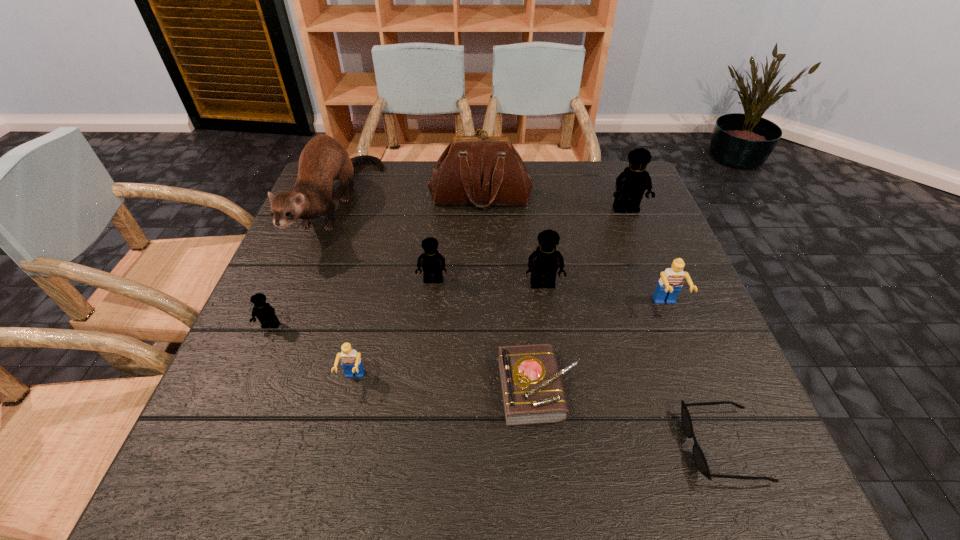
Locate an element on the screen. Image resolution: width=960 pixels, height=540 pixels. vacant area at the near edge of the desktop is located at coordinates (285, 495).

Where is `vacant space at the left edge of the desktop`? This screenshot has height=540, width=960. vacant space at the left edge of the desktop is located at coordinates (299, 268).

Find the location of a particular element. The width and height of the screenshot is (960, 540). vacant space at the right edge of the desktop is located at coordinates (705, 413).

Locate an element on the screen. The image size is (960, 540). free spot between the black sunglasses and the bigger blue Lego is located at coordinates 695,376.

The width and height of the screenshot is (960, 540). I want to click on unoccupied position between the second nearest Lego and the ninth tallest object, so click(404, 357).

The width and height of the screenshot is (960, 540). I want to click on free area in between the ninth tallest object and the shoulder bag, so pos(510,293).

The height and width of the screenshot is (540, 960). I want to click on vacant space in between the brown ferret and the leftmost yellow Lego, so click(x=304, y=267).

Find the location of a particular element. empty location between the shoulder bag and the farthest yellow Lego is located at coordinates (553, 204).

The width and height of the screenshot is (960, 540). Identify the location of vacant space that is in between the leftmost Lego and the brown shoulder bag. (375, 262).

At what (x,y) coordinates should I click in order to perform the action: click on vacant space that's between the third nearest Lego and the leftmost Lego. Please return your answer as a coordinate pair (x, y). Image resolution: width=960 pixels, height=540 pixels. Looking at the image, I should click on (468, 316).